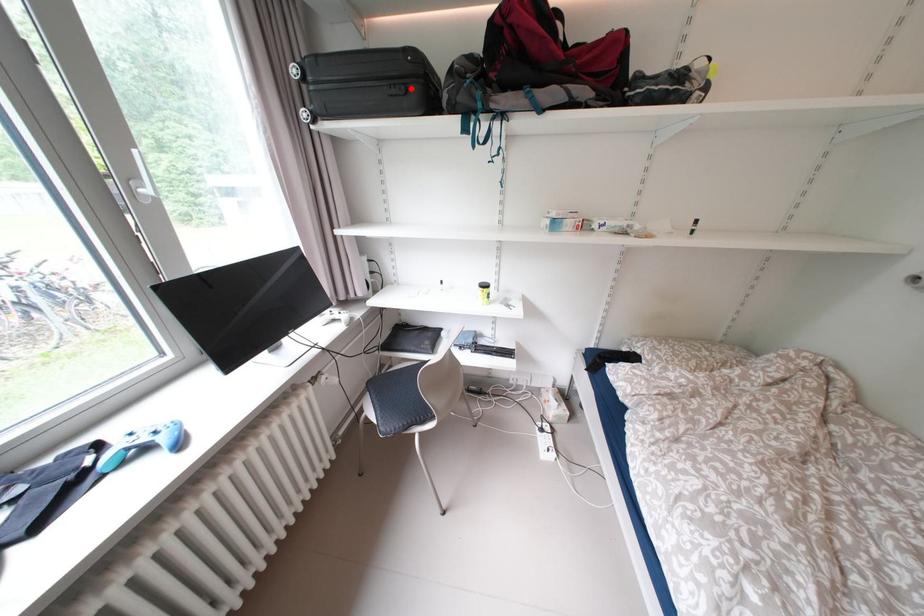
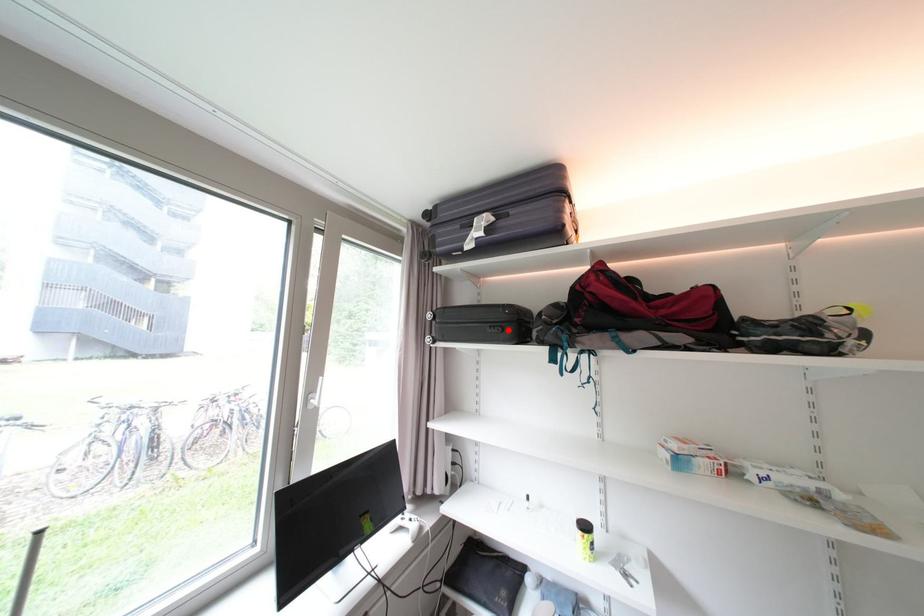
I am providing you with two images of the same scene from different viewpoints. A red point is marked on the first image and another point is marked on the second image. Are the points marked in image1 and image2 representing the same 3D position?

Yes